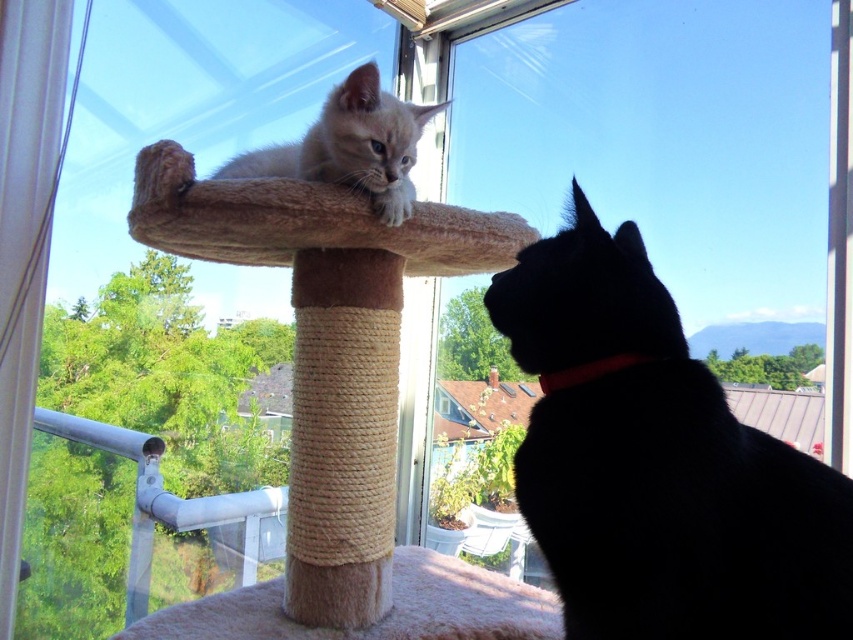
Question: Observing the image, what is the correct spatial positioning of black fur cat at upper right in reference to light brown fur at upper center?

Choices:
 (A) below
 (B) above

Answer: (A)

Question: Among these objects, which one is farthest from the camera?

Choices:
 (A) beige plush cat bed at center
 (B) red fabric neckband at lower right

Answer: (A)

Question: Estimate the real-world distances between objects in this image. Which object is farther from the black fur cat at upper right?

Choices:
 (A) beige plush cat bed at center
 (B) light brown fur at upper center

Answer: (A)

Question: Where is black fur cat at upper right located in relation to light brown fur at upper center in the image?

Choices:
 (A) below
 (B) above

Answer: (A)

Question: In this image, where is black fur cat at upper right located relative to red fabric neckband at lower right?

Choices:
 (A) below
 (B) above

Answer: (A)

Question: Which point is closer to the camera taking this photo?

Choices:
 (A) (590, 362)
 (B) (392, 122)

Answer: (A)